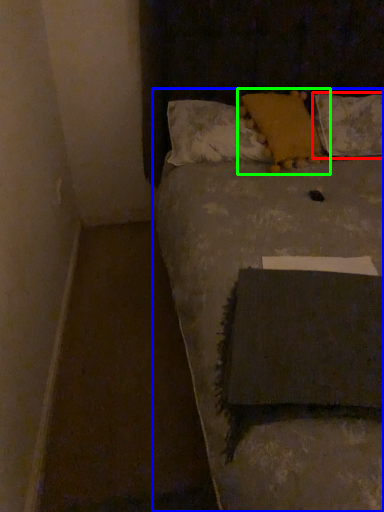
Question: Which object is positioned closest to pillow (highlighted by a red box)? Select from furniture (highlighted by a blue box) and pillow (highlighted by a green box).

Choices:
 (A) furniture
 (B) pillow

Answer: (B)